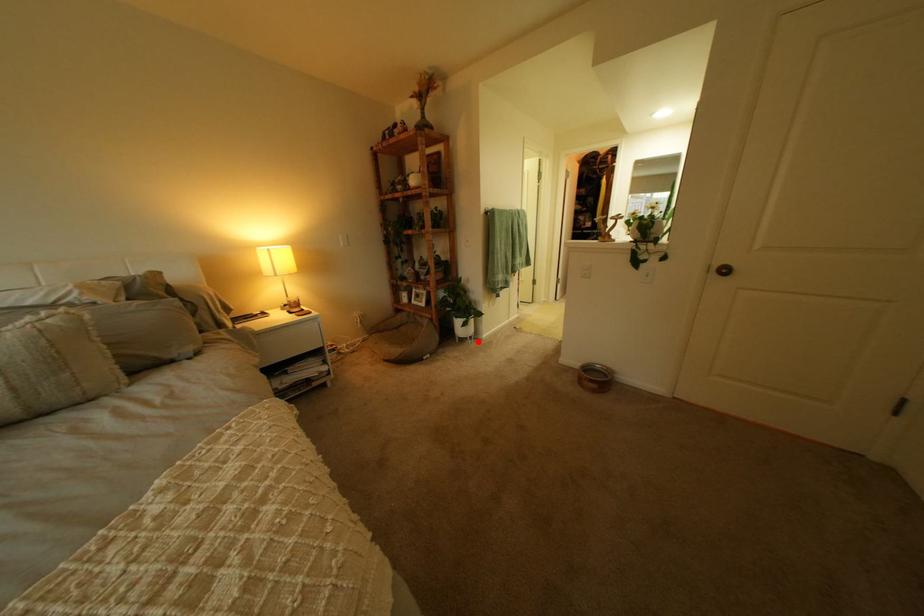
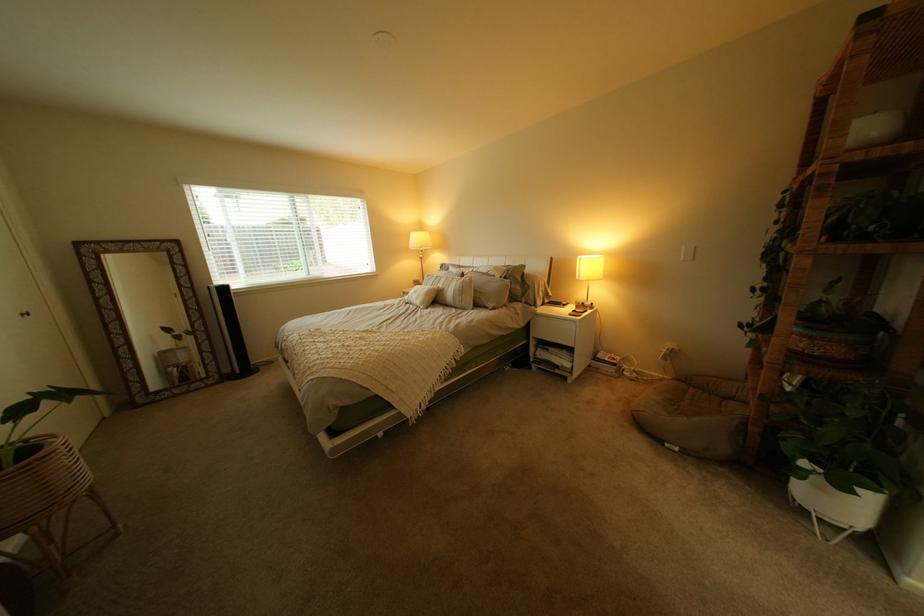
Question: I am providing you with two images of the same scene from different viewpoints. In image1, a red point is highlighted. Considering the same 3D point in image2, which of the following is correct?

Choices:
 (A) It is closer
 (B) It is farther

Answer: (B)